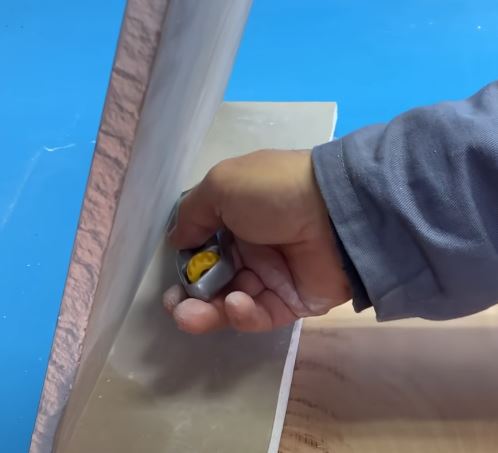
Locate an element on the screen. white colored sheetrock edge is located at coordinates (69, 314).